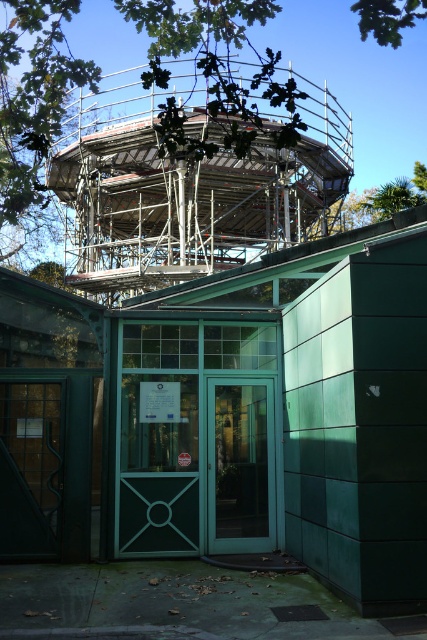
Is point (239, 513) behind point (248, 392)?

No.

What are the coordinates of `teal glass door at center` in the screenshot? It's located at (196, 440).

Image resolution: width=427 pixels, height=640 pixels. I want to click on teal glass door at center, so click(196, 440).

Consider the image. Is metallic scaffolding at upper center taller than green glass door at center?

In fact, metallic scaffolding at upper center may be shorter than green glass door at center.

Consider the image. Does metallic scaffolding at upper center appear on the left side of green glass door at center?

Yes, metallic scaffolding at upper center is to the left of green glass door at center.

Where is `metallic scaffolding at upper center`? This screenshot has height=640, width=427. metallic scaffolding at upper center is located at coordinates pos(230,417).

Does teal glass door at center come in front of green leafy tree at upper center?

Yes, teal glass door at center is in front of green leafy tree at upper center.

Who is higher up, teal glass door at center or green leafy tree at upper center?

green leafy tree at upper center

Between point (236, 324) and point (300, 58), which one is positioned in front?

Point (236, 324) is in front.

Where is `teal glass door at center`? The image size is (427, 640). teal glass door at center is located at coordinates (196, 440).